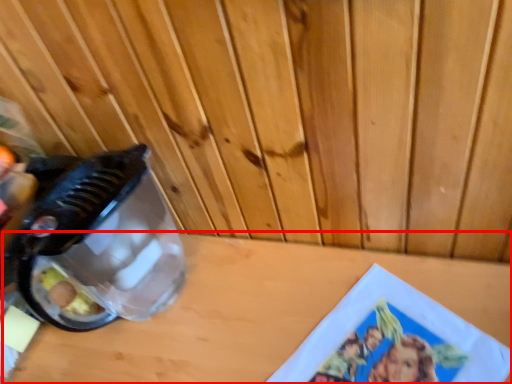
Question: Where is table top (annotated by the red box) located in relation to appliance in the image?

Choices:
 (A) right
 (B) left

Answer: (A)